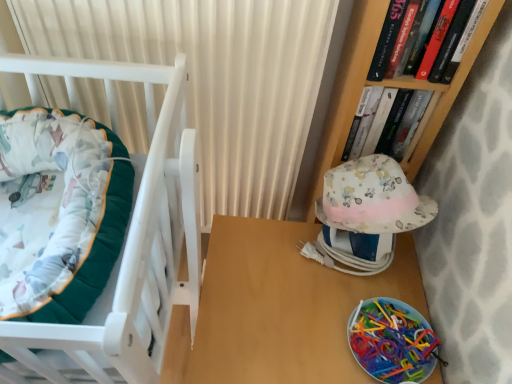
This screenshot has width=512, height=384. I want to click on free location to the left of translucent plastic plate at lower right, so click(303, 318).